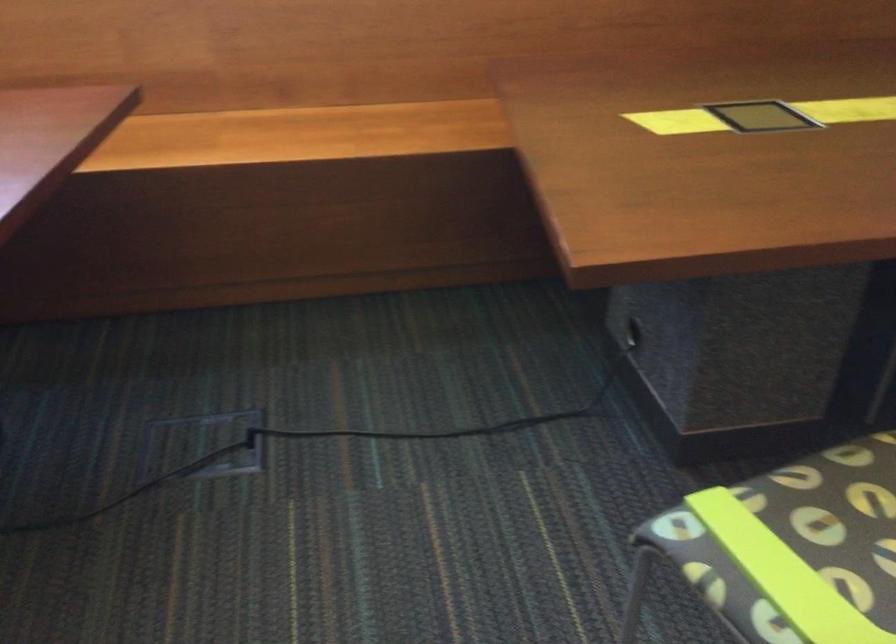
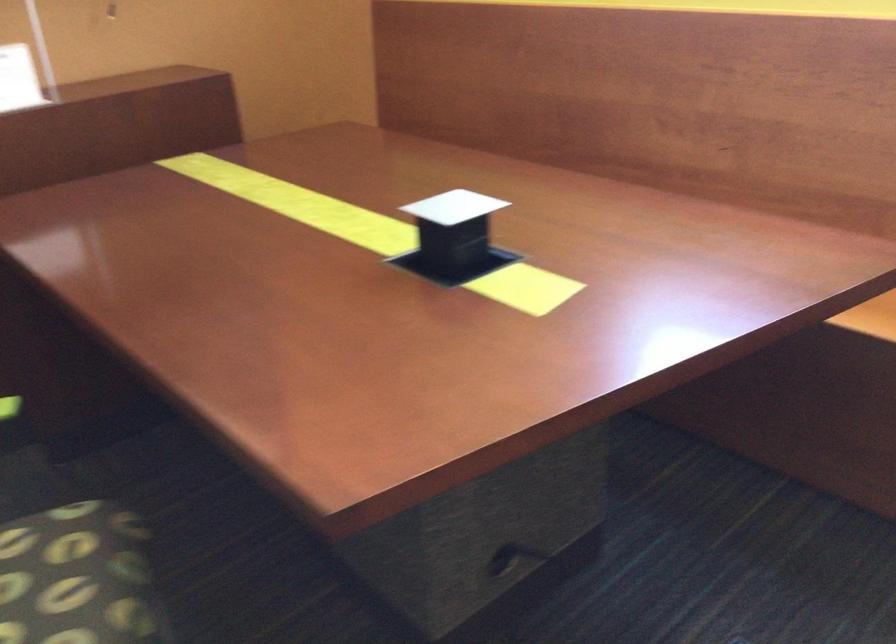
Question: The camera is either moving clockwise (left) or counter-clockwise (right) around the object. The first image is from the beginning of the video and the second image is from the end. Is the camera moving left or right when shooting the video?

Choices:
 (A) Left
 (B) Right

Answer: (B)